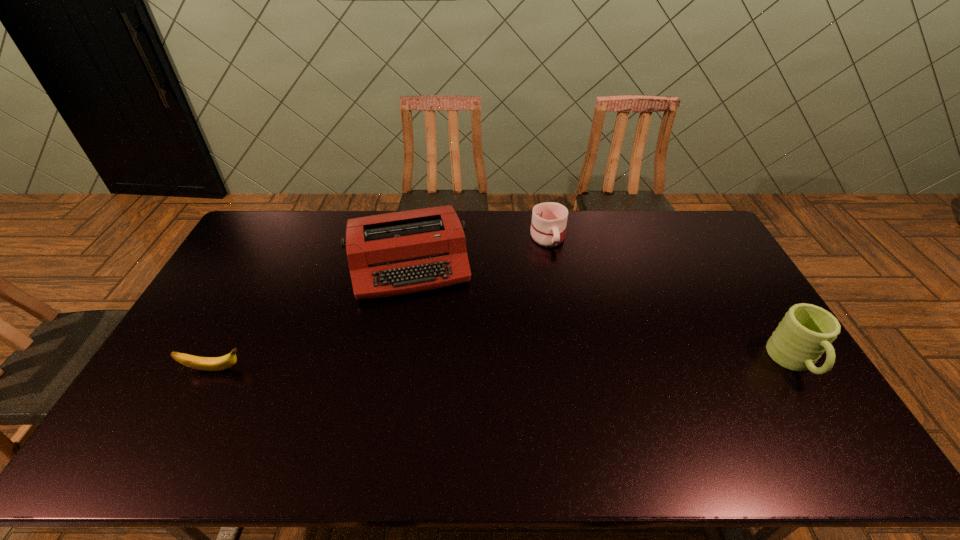
Find the location of a particular element. vacant space at the far edge of the desktop is located at coordinates (579, 237).

Identify the location of vacant space at the near edge of the desktop. Image resolution: width=960 pixels, height=540 pixels. click(612, 411).

Image resolution: width=960 pixels, height=540 pixels. I want to click on vacant area at the far left corner of the desktop, so click(x=269, y=239).

Locate an element on the screen. The height and width of the screenshot is (540, 960). free space at the far right corner of the desktop is located at coordinates (663, 213).

You are a GUI agent. You are given a task and a screenshot of the screen. Output one action in this format:
    pyautogui.click(x=<x>, y=<y>)
    Task: Click on the empty space between the taller mug and the second object from left to right
    
    Given the screenshot: What is the action you would take?
    602,313

Where is `vacant area that lies between the shortest object and the typewriter`? vacant area that lies between the shortest object and the typewriter is located at coordinates (312, 317).

Find the location of a particular element. The image size is (960, 540). empty space between the right mug and the typewriter is located at coordinates (602, 313).

In order to click on vacant space that is in between the left mug and the rightmost object in this screenshot , I will do [671, 300].

Identify the location of empty space that is in between the nearer mug and the second shortest object. (671, 300).

This screenshot has width=960, height=540. What are the coordinates of `vacant area that lies between the leftmost object and the second shortest object` in the screenshot? It's located at (381, 303).